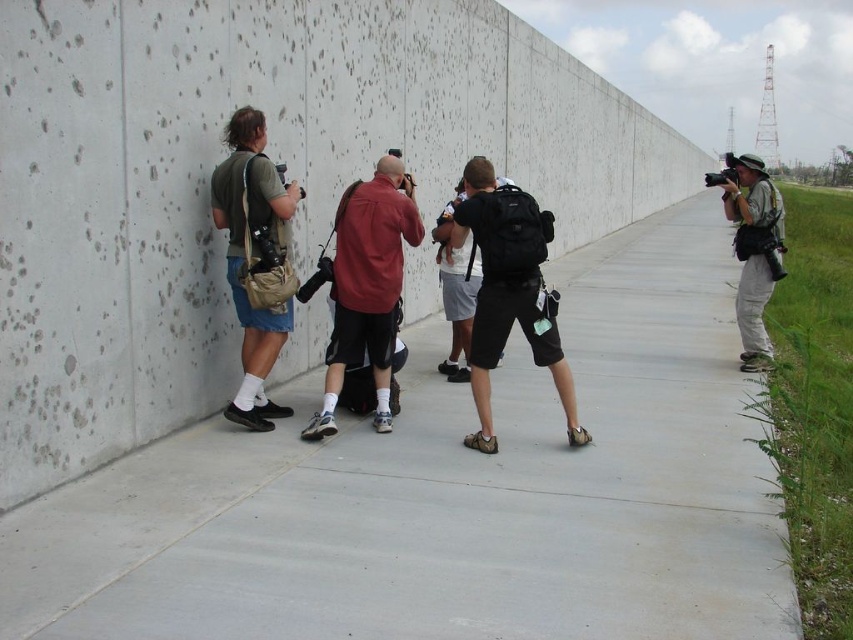
You are standing at the curved concrete wall and want to take a photo of both the point at coordinates (740, 531) and the point at coordinates (282, 208). Which point should you focus on first to ensure both are in the frame?

You should focus on point (740, 531) first because it is closer to you than point (282, 208), so by focusing there, the other point will also be in focus if within the depth of field.

You are standing at the center of the image and want to take a photo of the gray concrete wall at center. Which direction should you move to get closer to the wall?

The gray concrete wall at center is located at point (273, 160), so you should move towards the coordinates (273, 160) to get closer to the wall.